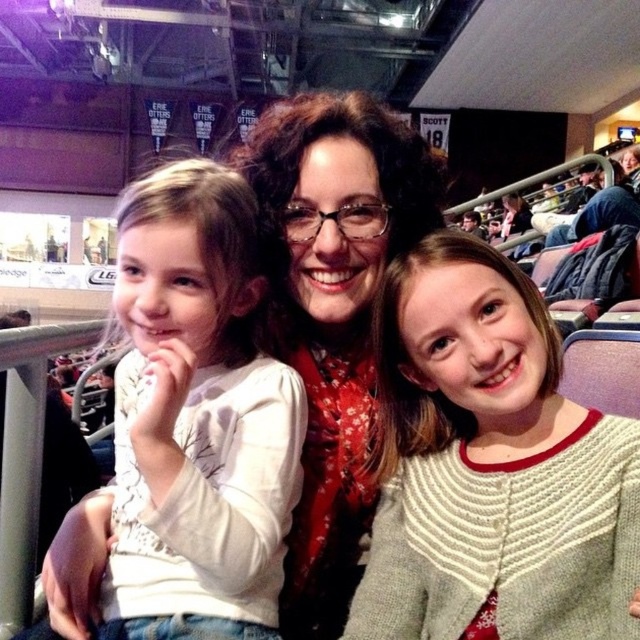
You are a photographer trying to capture a closeup of the two girls sitting beside the woman in the image. Given that the white knitted cardigan at center and the white matte shirt at center are both visible in your frame, which clothing item takes up less space in the photo?

The white knitted cardigan at center takes up less space in the photo because it has a smaller size compared to the white matte shirt at center.

You are a photographer trying to capture a closeup of the white knitted cardigan at center and the white matte shirt at center. Which one should you focus on if you want to photograph the taller item?

The white matte shirt at center is taller than the white knitted cardigan at center, so you should focus on the white matte shirt at center to photograph the taller item.